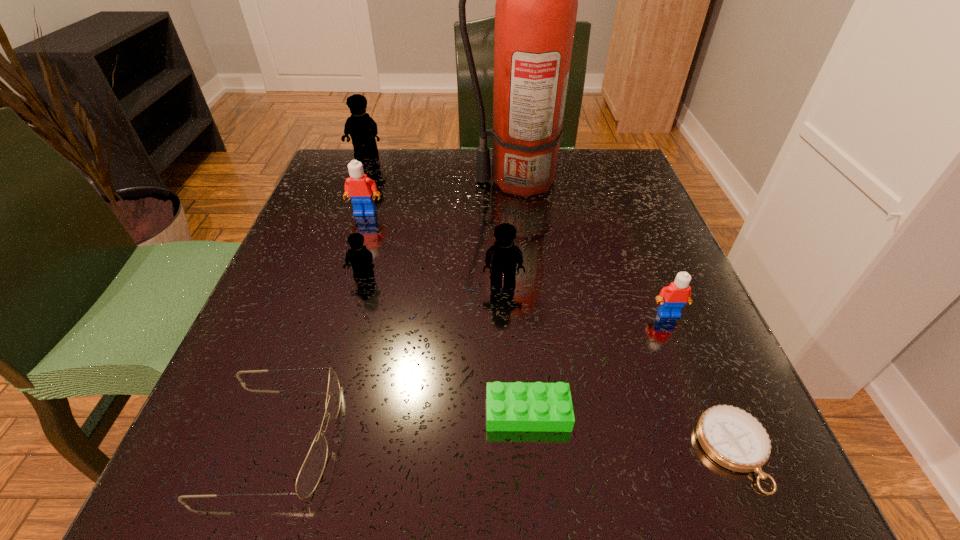
Where is `spectacles situated at the left edge`? The image size is (960, 540). spectacles situated at the left edge is located at coordinates (312, 469).

Where is `fire extinguisher at the right edge`? fire extinguisher at the right edge is located at coordinates (536, 6).

You are a GUI agent. You are given a task and a screenshot of the screen. Output one action in this format:
    pyautogui.click(x=<x>, y=<y>)
    Task: Click on the Lego at the right edge
    This screenshot has width=960, height=540.
    Given the screenshot: What is the action you would take?
    pyautogui.click(x=672, y=298)

At what (x,y) coordinates should I click in order to perform the action: click on compass that is at the right edge. Please return your answer as a coordinate pair (x, y). This screenshot has width=960, height=540. Looking at the image, I should click on (733, 438).

Where is `object located in the far left corner section of the desktop`? object located in the far left corner section of the desktop is located at coordinates (362, 128).

Find the location of `object located at the near left corner`. object located at the near left corner is located at coordinates coord(312,469).

This screenshot has height=540, width=960. I want to click on object positioned at the far right corner, so tap(536, 6).

This screenshot has width=960, height=540. Identify the location of object that is at the near right corner. click(x=733, y=438).

The image size is (960, 540). Identify the location of vacant space at the far edge of the desktop. (447, 195).

Identify the location of free point at the near edge. The width and height of the screenshot is (960, 540). (416, 475).